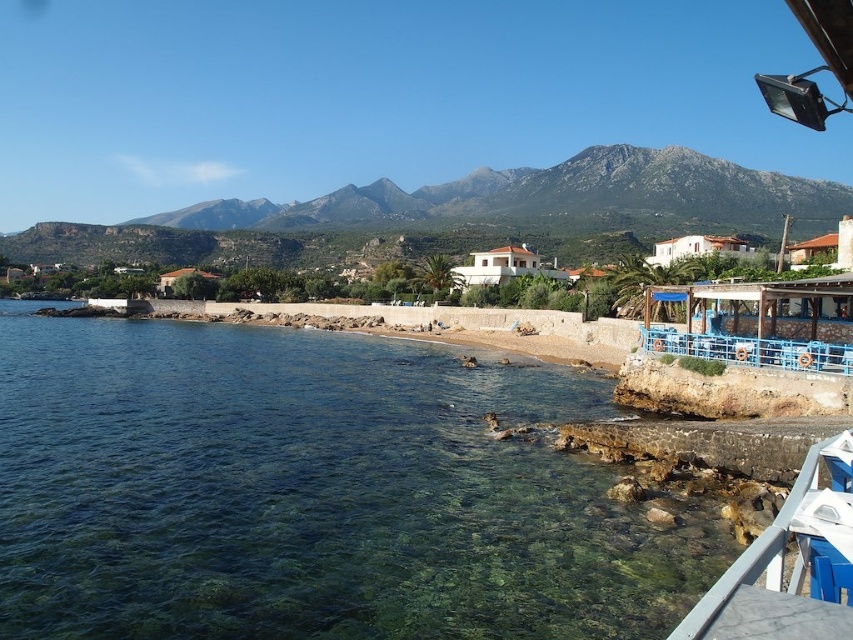
How distant is clear water at lower left from white painted wood dock at lower right?

The distance of clear water at lower left from white painted wood dock at lower right is 19.60 meters.

Can you confirm if clear water at lower left is positioned below white painted wood dock at lower right?

No.

Identify the location of clear water at lower left. This screenshot has width=853, height=640. (312, 492).

I want to click on clear water at lower left, so click(x=312, y=492).